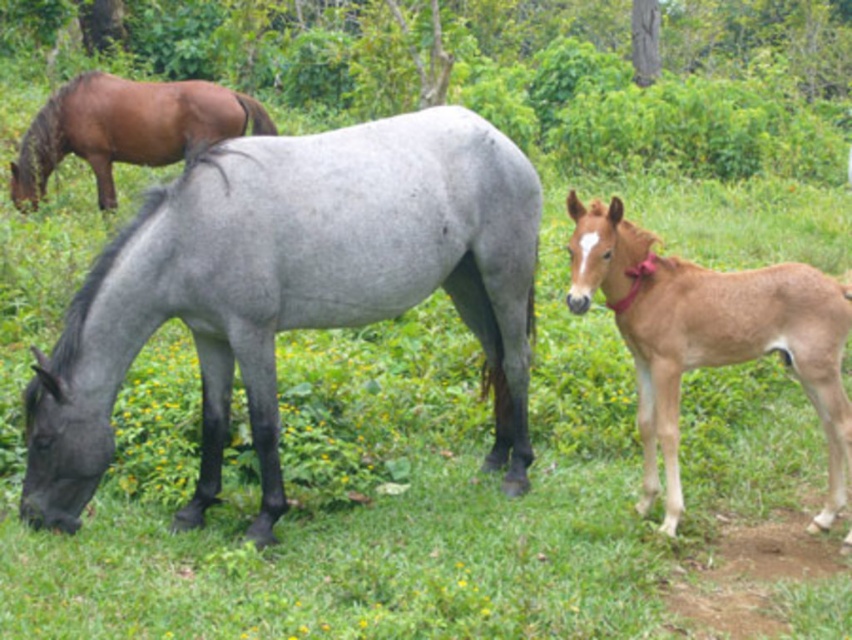
Question: Among these points, which one is nearest to the camera?

Choices:
 (A) (366, 132)
 (B) (839, 416)
 (C) (188, 150)

Answer: (B)

Question: Does gray matte horse at center have a lesser width compared to brown smooth foal at right?

Choices:
 (A) no
 (B) yes

Answer: (A)

Question: From the image, what is the correct spatial relationship of gray matte horse at center in relation to brown smooth foal at right?

Choices:
 (A) right
 (B) left

Answer: (B)

Question: Which point is closer to the camera taking this photo?

Choices:
 (A) (758, 304)
 (B) (55, 109)
 (C) (96, 266)

Answer: (C)

Question: Which is nearer to the gray matte horse at center?

Choices:
 (A) brown smooth foal at right
 (B) brown glossy horse at upper left

Answer: (A)

Question: Is brown smooth foal at right wider than brown glossy horse at upper left?

Choices:
 (A) no
 (B) yes

Answer: (A)